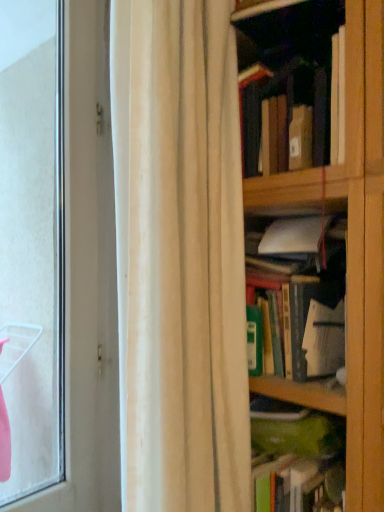
Question: Should I look upward or downward to see green matte book at center, the 1th book from the bottom?

Choices:
 (A) up
 (B) down

Answer: (B)

Question: Considering the relative sizes of green matte book at center, which appears as the 2th book when viewed from the top, and green matte book at center, the 1th book from the bottom, in the image provided, is green matte book at center, which appears as the 2th book when viewed from the top, smaller than green matte book at center, the 1th book from the bottom,?

Choices:
 (A) no
 (B) yes

Answer: (B)

Question: Is green matte book at center, which ranks as the 2th book in bottom-to-top order, not inside green matte book at center, which ranks as the 3th book in top-to-bottom order?

Choices:
 (A) yes
 (B) no

Answer: (A)

Question: Does green matte book at center, which ranks as the 2th book in bottom-to-top order, have a lesser height compared to green matte book at center, which ranks as the 3th book in top-to-bottom order?

Choices:
 (A) yes
 (B) no

Answer: (B)

Question: Is green matte book at center, which ranks as the 2th book in bottom-to-top order, turned away from green matte book at center, the 1th book from the bottom?

Choices:
 (A) yes
 (B) no

Answer: (B)

Question: Is green matte book at center, which appears as the 2th book when viewed from the top, positioned behind green matte book at center, which ranks as the 3th book in top-to-bottom order?

Choices:
 (A) yes
 (B) no

Answer: (A)

Question: Is green matte book at center, which ranks as the 2th book in bottom-to-top order, in front of green matte book at center, which ranks as the 3th book in top-to-bottom order?

Choices:
 (A) yes
 (B) no

Answer: (B)

Question: Does hardcover book at upper right, which is the first book from top to bottom, have a greater height compared to green matte book at center, which ranks as the 3th book in top-to-bottom order?

Choices:
 (A) yes
 (B) no

Answer: (A)

Question: From the image's perspective, is hardcover book at upper right, which is the first book from top to bottom, beneath green matte book at center, which ranks as the 3th book in top-to-bottom order?

Choices:
 (A) yes
 (B) no

Answer: (B)

Question: Is hardcover book at upper right, marked as the 3th book in a bottom-to-top arrangement, located outside green matte book at center, which ranks as the 3th book in top-to-bottom order?

Choices:
 (A) yes
 (B) no

Answer: (A)

Question: Is hardcover book at upper right, marked as the 3th book in a bottom-to-top arrangement, smaller than green matte book at center, the 1th book from the bottom?

Choices:
 (A) no
 (B) yes

Answer: (A)

Question: Is the depth of hardcover book at upper right, marked as the 3th book in a bottom-to-top arrangement, greater than that of green matte book at center, the 1th book from the bottom?

Choices:
 (A) no
 (B) yes

Answer: (B)

Question: Is hardcover book at upper right, marked as the 3th book in a bottom-to-top arrangement, in contact with green matte book at center, the 1th book from the bottom?

Choices:
 (A) yes
 (B) no

Answer: (B)

Question: Is hardcover book at upper right, marked as the 3th book in a bottom-to-top arrangement, in front of white fabric curtain at center?

Choices:
 (A) yes
 (B) no

Answer: (B)